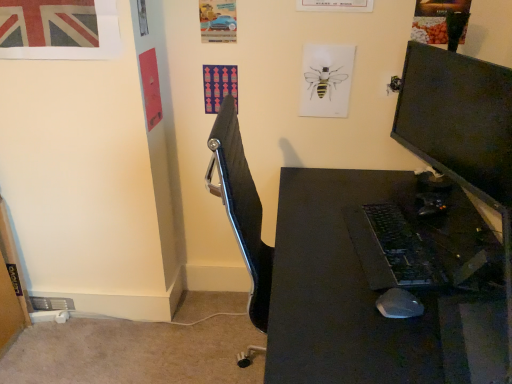
Locate an element on the screen. Image resolution: width=512 pixels, height=384 pixels. free spot in front of black plastic keyboard at center-right is located at coordinates (368, 314).